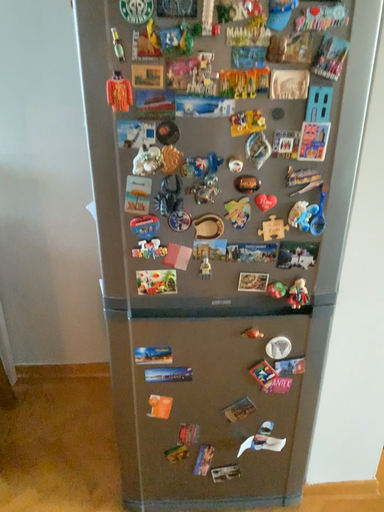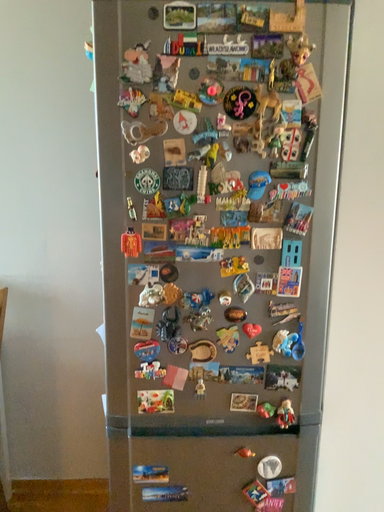
Question: How did the camera likely rotate when shooting the video?

Choices:
 (A) rotated downward
 (B) rotated upward

Answer: (B)